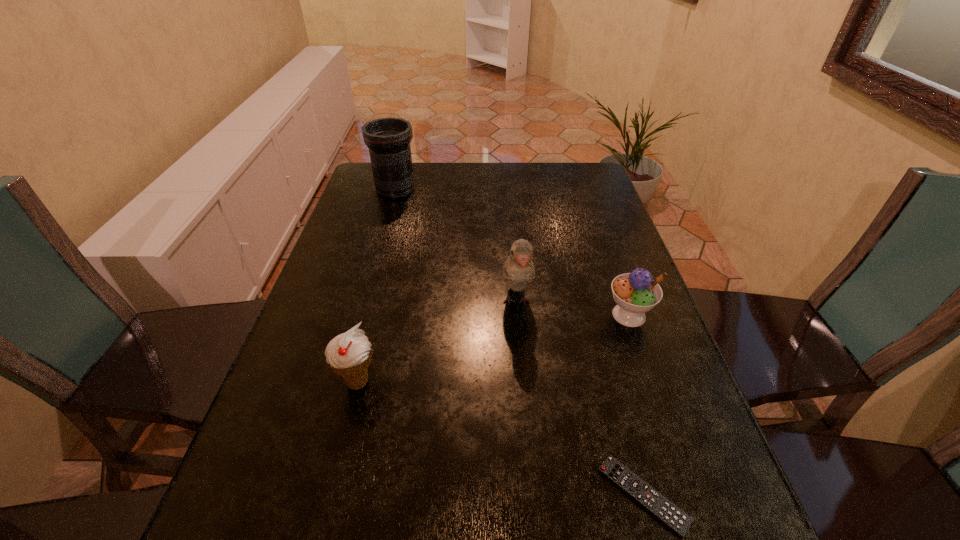
Identify the location of vacant region between the telephoto lens and the third object from right to left. (456, 246).

Identify the location of free space between the fourth farthest object and the third object from left to right. The image size is (960, 540). (437, 342).

Locate an element on the screen. The height and width of the screenshot is (540, 960). the second closest object relative to the telephoto lens is located at coordinates (349, 354).

Where is `the closest object to the remote control`? The image size is (960, 540). the closest object to the remote control is located at coordinates (635, 293).

Where is `free space that satisfies the following two spatial constraints: 1. on the back side of the farther icecream; 2. on the right side of the remote control`? free space that satisfies the following two spatial constraints: 1. on the back side of the farther icecream; 2. on the right side of the remote control is located at coordinates (594, 315).